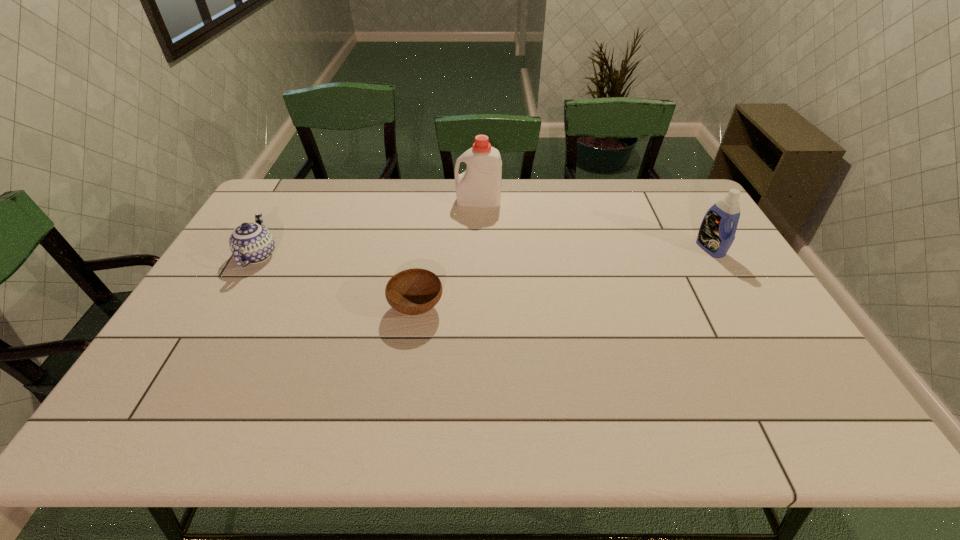
The height and width of the screenshot is (540, 960). In order to click on the left detergent in this screenshot , I will do (479, 185).

Locate an element on the screen. Image resolution: width=960 pixels, height=540 pixels. the third object from left to right is located at coordinates (479, 185).

What are the coordinates of `the nearer detergent` in the screenshot? It's located at (716, 234).

Locate an element on the screen. This screenshot has height=540, width=960. the rightmost object is located at coordinates click(x=716, y=234).

Where is `chinaware`? Image resolution: width=960 pixels, height=540 pixels. chinaware is located at coordinates (252, 243).

This screenshot has width=960, height=540. In order to click on the third tallest object in this screenshot , I will do `click(252, 243)`.

Locate an element on the screen. This screenshot has height=540, width=960. bowl is located at coordinates (415, 291).

Locate an element on the screen. The image size is (960, 540). the second object from left to right is located at coordinates tap(415, 291).

Find the location of a particular element. The image size is (960, 540). vacant space located 0.350m on the handle side of the third object from left to right is located at coordinates (357, 201).

Where is `vacant area located 0.170m on the handle side of the third object from left to right`? vacant area located 0.170m on the handle side of the third object from left to right is located at coordinates click(408, 201).